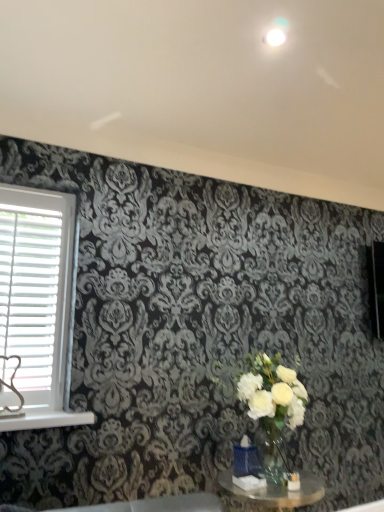
Question: Is clear glass table at lower center in front of or behind white plastic window sill at lower left in the image?

Choices:
 (A) behind
 (B) front

Answer: (B)

Question: In terms of height, does clear glass table at lower center look taller or shorter compared to white plastic window sill at lower left?

Choices:
 (A) tall
 (B) short

Answer: (A)

Question: Estimate the real-world distances between objects in this image. Which object is closer to the white plastic blinds at left?

Choices:
 (A) clear glass table at lower center
 (B) white plastic window sill at lower left

Answer: (B)

Question: Considering the real-world distances, which object is closest to the white plastic blinds at left?

Choices:
 (A) clear glass table at lower center
 (B) white plastic window sill at lower left

Answer: (B)